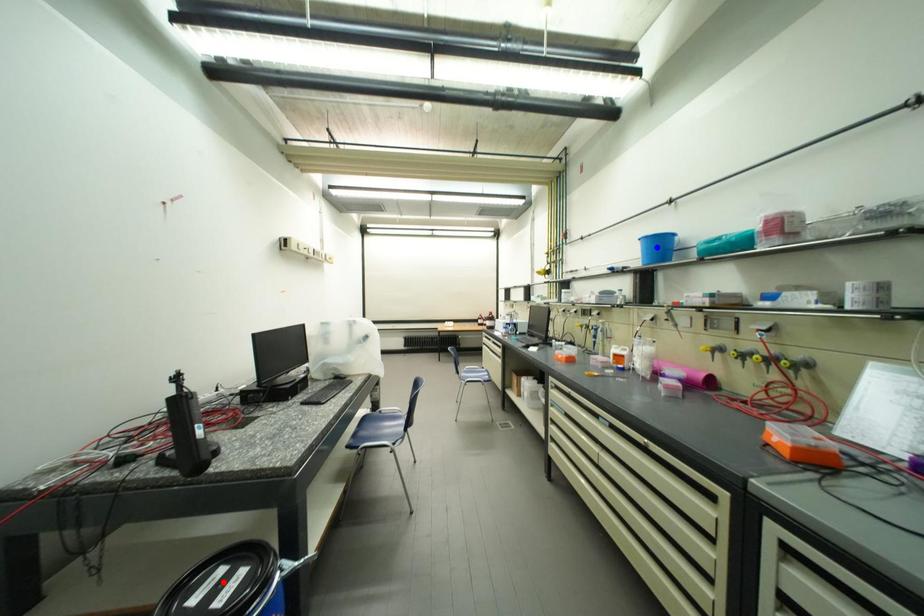
Question: In the image, two points are highlighted. Which point is nearer to the camera? Reply with the corresponding letter.

Choices:
 (A) blue point
 (B) red point

Answer: (B)